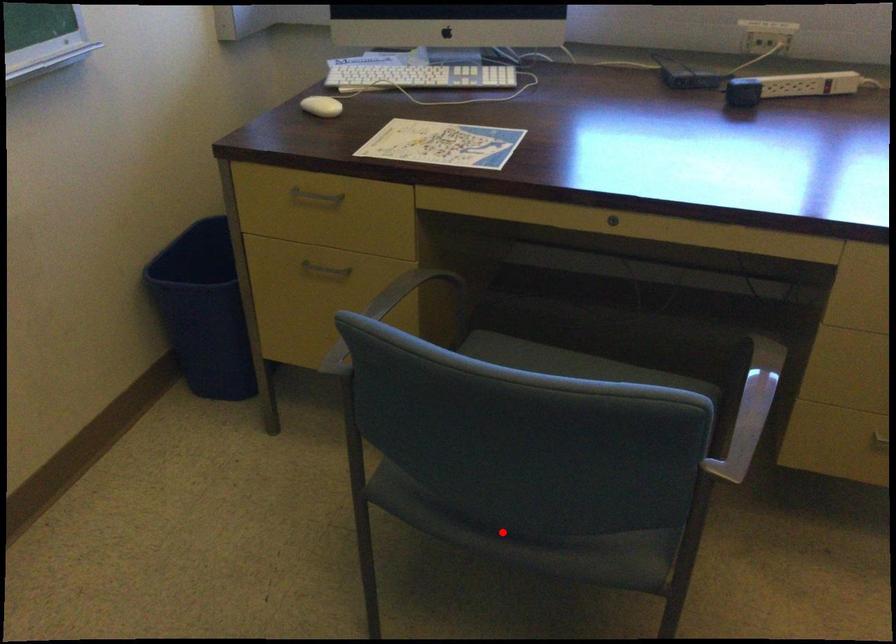
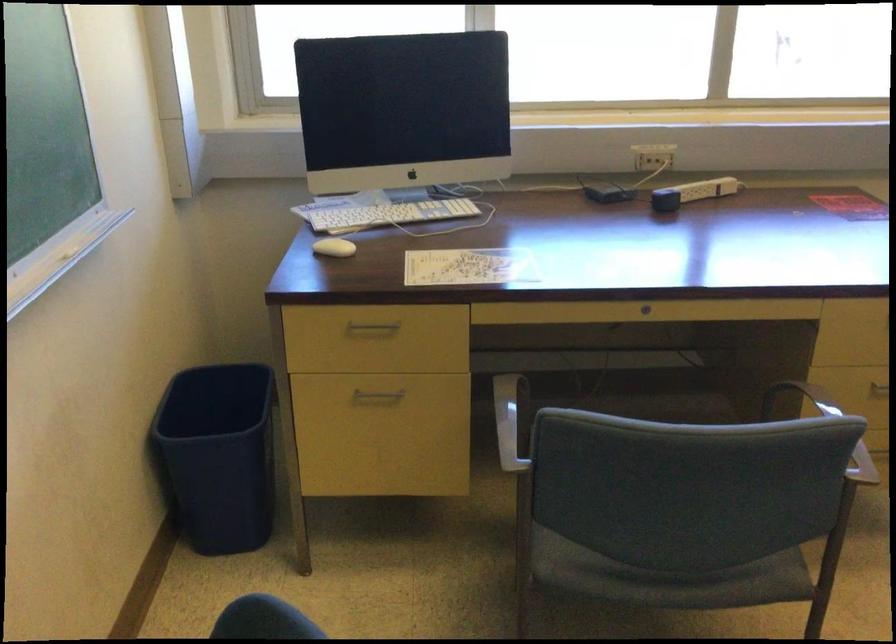
The point at the highlighted location is marked in the first image. Where is the corresponding point in the second image?

(668, 578)